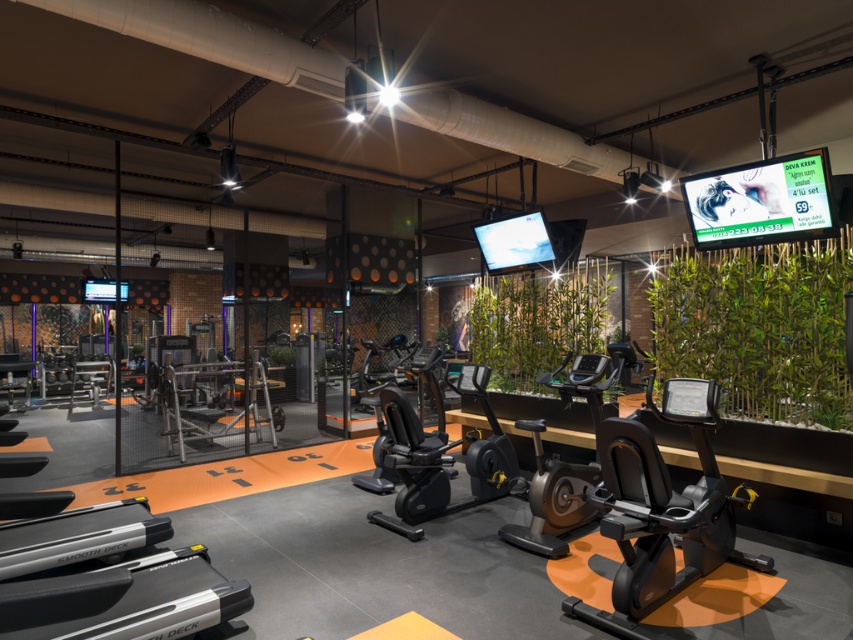
Who is positioned more to the left, green leafy plant at right or green leafy plant at center?

Positioned to the left is green leafy plant at center.

Does green leafy plant at right appear over green leafy plant at center?

Indeed, green leafy plant at right is positioned over green leafy plant at center.

Locate an element on the screen. green leafy plant at right is located at coordinates (758, 326).